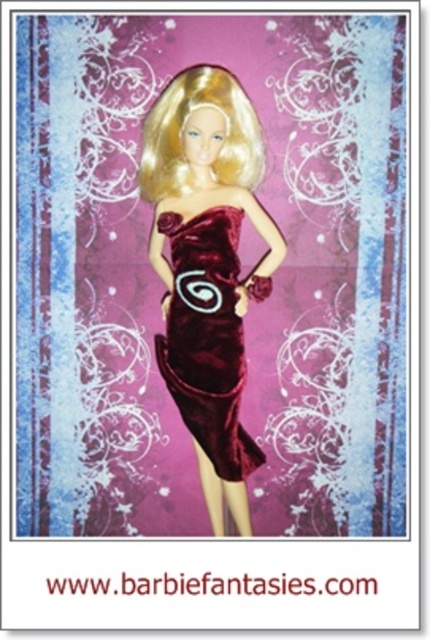
Who is positioned more to the right, velvet dress at center or velvet burgundy dress at center?

From the viewer's perspective, velvet dress at center appears more on the right side.

Between velvet dress at center and velvet burgundy dress at center, which one appears on the left side from the viewer's perspective?

velvet burgundy dress at center

Locate an element on the screen. velvet dress at center is located at coordinates (208, 266).